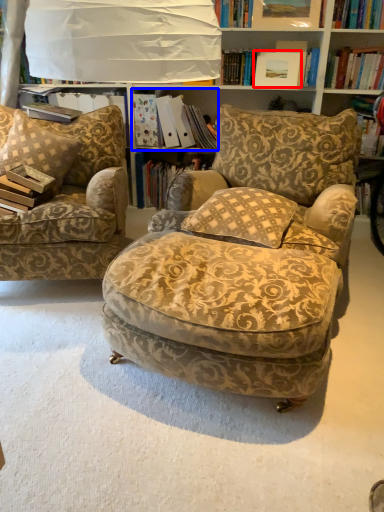
Question: Which object is further to the camera taking this photo, picture frame (highlighted by a red box) or book (highlighted by a blue box)?

Choices:
 (A) picture frame
 (B) book

Answer: (B)